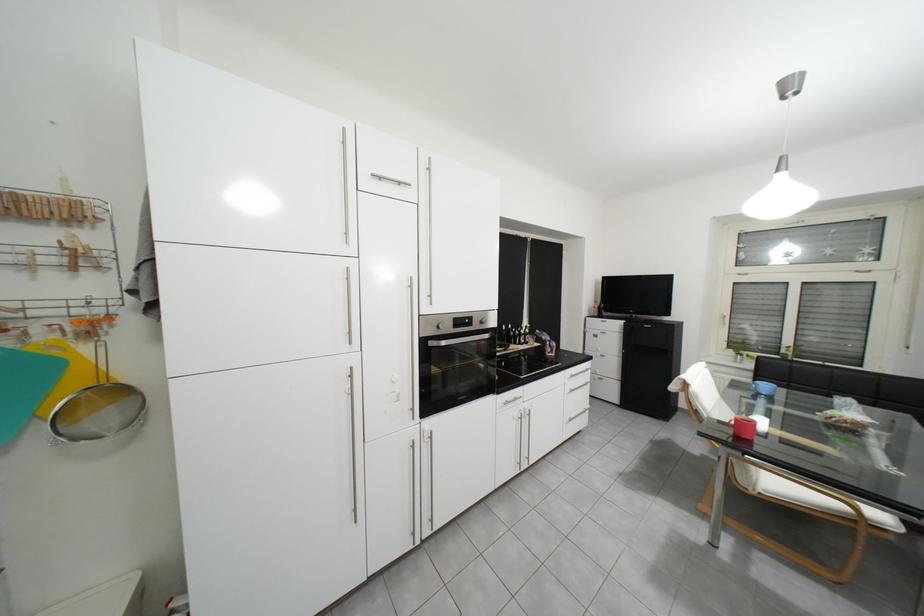
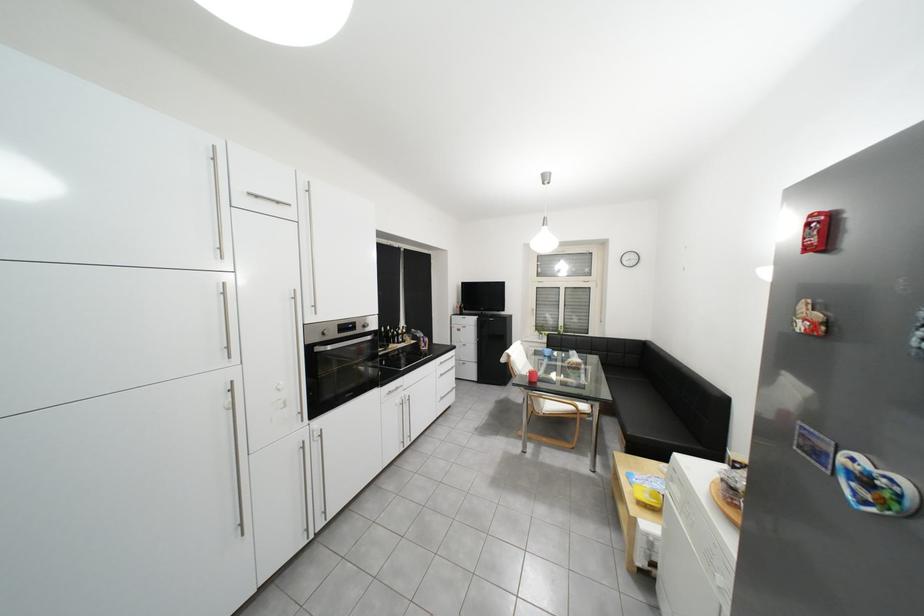
In the second image, find the point that corresponds to the point at 748,386 in the first image.

(548, 354)